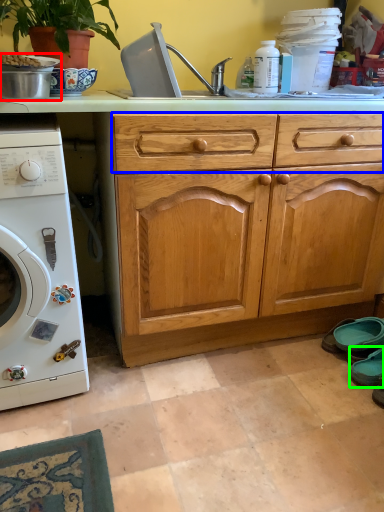
Question: Estimate the real-world distances between objects in this image. Which object is farther from appliance (highlighted by a red box), drawer (highlighted by a blue box) or shoe (highlighted by a green box)?

Choices:
 (A) drawer
 (B) shoe

Answer: (B)